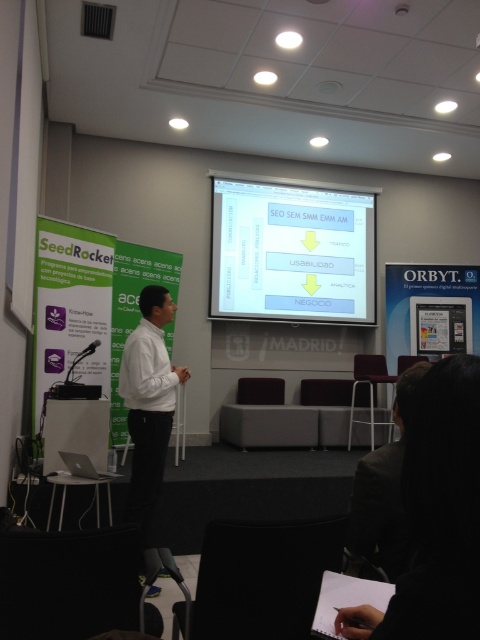
Question: Is white glossy projector screen at upper center below black fabric hair at lower right?

Choices:
 (A) yes
 (B) no

Answer: (B)

Question: In this image, where is white glossy projector screen at upper center located relative to white matte shirt at center?

Choices:
 (A) right
 (B) left

Answer: (A)

Question: Which point appears farthest from the camera in this image?

Choices:
 (A) [155, 461]
 (B) [400, 560]

Answer: (A)

Question: Which point appears closest to the camera in this image?

Choices:
 (A) (471, 624)
 (B) (263, 289)
 (C) (349, 518)
 (D) (124, 365)

Answer: (A)

Question: Is white glossy projector screen at upper center above black fabric hair at lower right?

Choices:
 (A) yes
 (B) no

Answer: (A)

Question: Estimate the real-world distances between objects in this image. Which object is farther from the white glossy projector screen at upper center?

Choices:
 (A) black fabric hair at lower right
 (B) white matte shirt at center

Answer: (A)